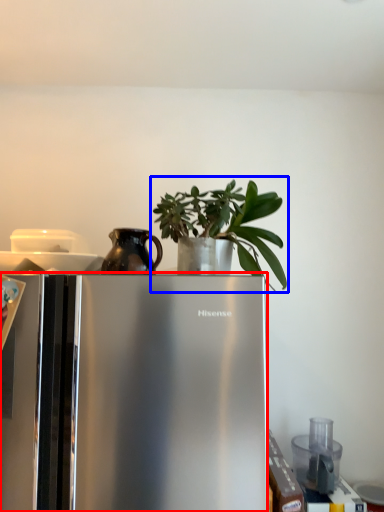
Question: Which of the following is the farthest to the observer, refrigerator (highlighted by a red box) or houseplant (highlighted by a blue box)?

Choices:
 (A) refrigerator
 (B) houseplant

Answer: (B)